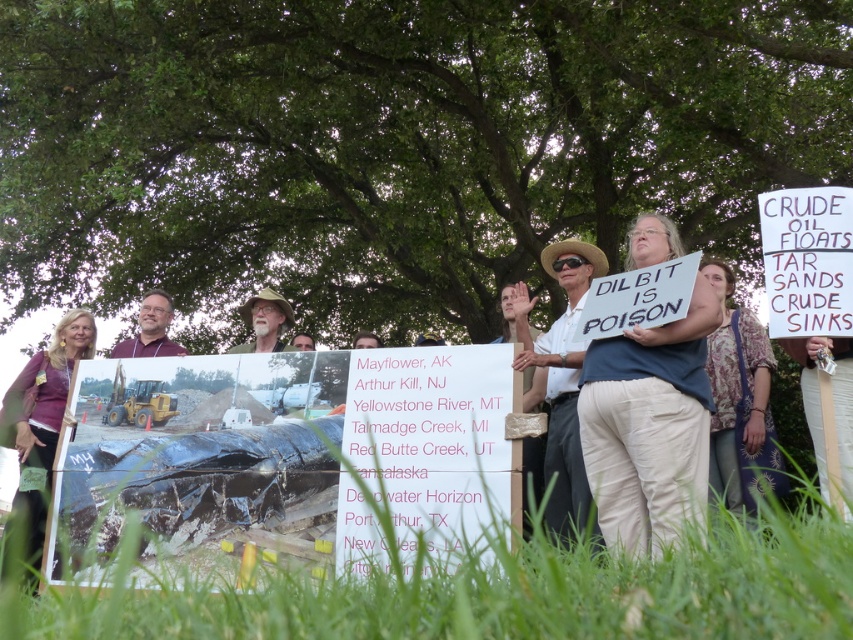
You are a photographer trying to capture a clear photo of the white cotton shirt at center and the purple fabric shirt at center. Which shirt should you focus on to ensure it takes up more space in the photo?

The purple fabric shirt at center occupies more space than the white cotton shirt at center, so focusing on the purple fabric shirt at center will ensure it takes up more space in the photo.

What are the coordinates of the white cotton shirt at center?

The white cotton shirt at center is located at point (561,378).